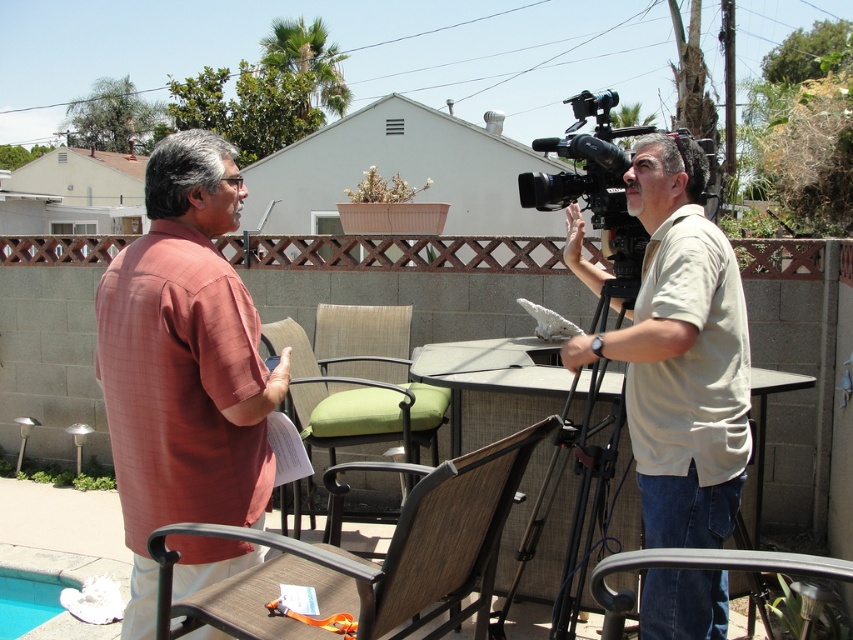
You are a camera operator who needs to move the black metal tripod at center closer to the green fabric chair at center by 0.5 meters. Is this possible without overlapping them?

The current distance between the black metal tripod at center and the green fabric chair at center is 1.09 meters. Moving the tripod closer by 0.5 meters would reduce the distance to 0.59 meters. Since this still maintains a separation between them, it is possible to move the black metal tripod at center closer to the green fabric chair at center by 0.5 meters without overlapping.

Looking at this image, you are setting up a small outdoor event and need to place both the black metal tripod at center and the green fabric chair at center in a tight space. Based on their sizes, which object should you place first to ensure both fit comfortably?

The black metal tripod at center occupies less space than the green fabric chair at center, so you should place the green fabric chair at center first to ensure there is enough space left for the tripod.

You are standing at the point labeled point (256, 602) and want to walk to the point labeled point (527, 548). Which direction should you face to walk directly toward your destination?

To walk directly toward point (527, 548) from point (256, 602), you should face northwest because point (256, 602) is in front of point (527, 548), indicating it is closer to the viewer and thus located to the northwest direction.